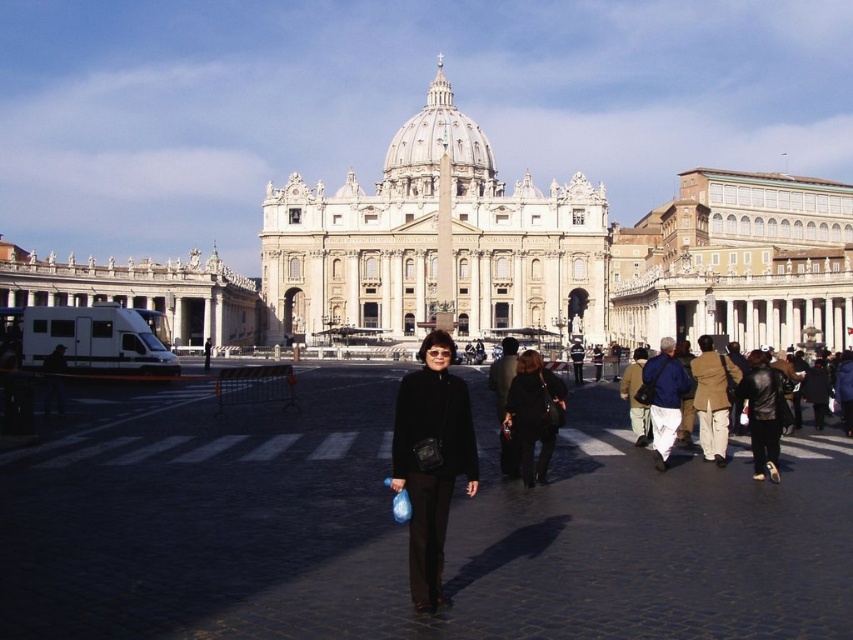
Does point (624, 244) lie in front of point (668, 412)?

That is False.

Where is `white marble palace at right`? white marble palace at right is located at coordinates (737, 260).

In the scene shown: Does white marble cathedral at center have a lesser height compared to black matte jacket at center?

No, white marble cathedral at center is not shorter than black matte jacket at center.

Can you confirm if white marble cathedral at center is wider than black matte jacket at center?

Correct, the width of white marble cathedral at center exceeds that of black matte jacket at center.

Which is behind, point (527, 262) or point (450, 394)?

The point (527, 262) is more distant.

At what (x,y) coordinates should I click in order to perform the action: click on white marble cathedral at center. Please return your answer as a coordinate pair (x, y). The image size is (853, 640). Looking at the image, I should click on (434, 243).

Is white marble palace at right positioned at the back of white marble palace at left?

Yes, white marble palace at right is further from the viewer.

Does white marble palace at right appear under white marble palace at left?

Incorrect, white marble palace at right is not positioned below white marble palace at left.

Is point (834, 234) positioned after point (9, 259)?

Yes.

Find the location of a particular element. This screenshot has height=640, width=853. white marble palace at right is located at coordinates (737, 260).